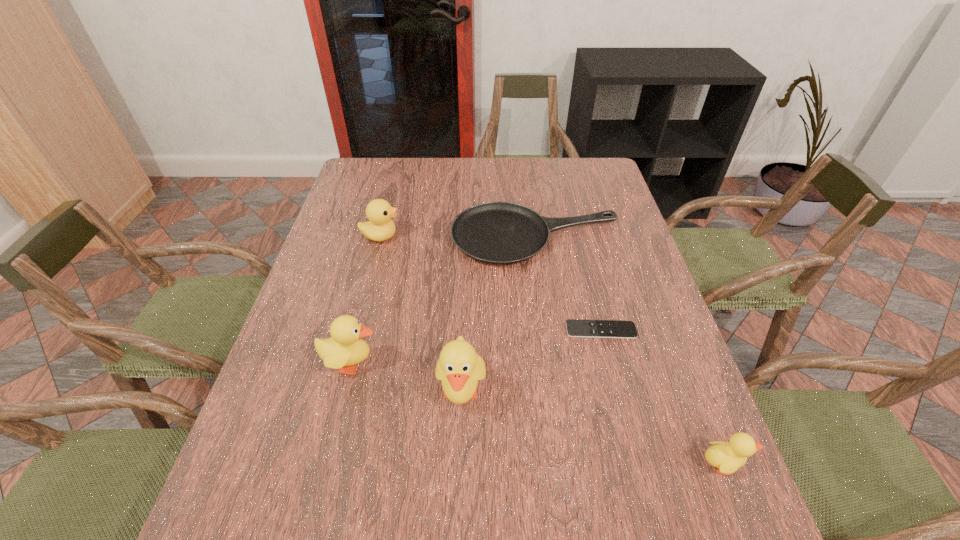
Locate an element on the screen. The height and width of the screenshot is (540, 960). free space located on the front-facing side of the second duckling from right to left is located at coordinates (459, 467).

Where is `free region located 0.250m on the face of the third tallest object`? The width and height of the screenshot is (960, 540). free region located 0.250m on the face of the third tallest object is located at coordinates [484, 236].

Locate an element on the screen. This screenshot has width=960, height=540. vacant area situated on the left of the fifth tallest object is located at coordinates (378, 237).

Where is `vacant space located on the front of the remote control`? The width and height of the screenshot is (960, 540). vacant space located on the front of the remote control is located at coordinates (625, 426).

Where is `object at the near edge`? The image size is (960, 540). object at the near edge is located at coordinates (727, 457).

The width and height of the screenshot is (960, 540). What are the coordinates of `duckling present at the left edge` in the screenshot? It's located at [345, 347].

Where is `duck that is at the left edge`? duck that is at the left edge is located at coordinates (380, 227).

The width and height of the screenshot is (960, 540). Identify the location of duckling situated at the right edge. (727, 457).

Find the location of a particular element. The height and width of the screenshot is (540, 960). frying pan at the right edge is located at coordinates (501, 233).

Locate an element on the screen. remote control at the right edge is located at coordinates (575, 328).